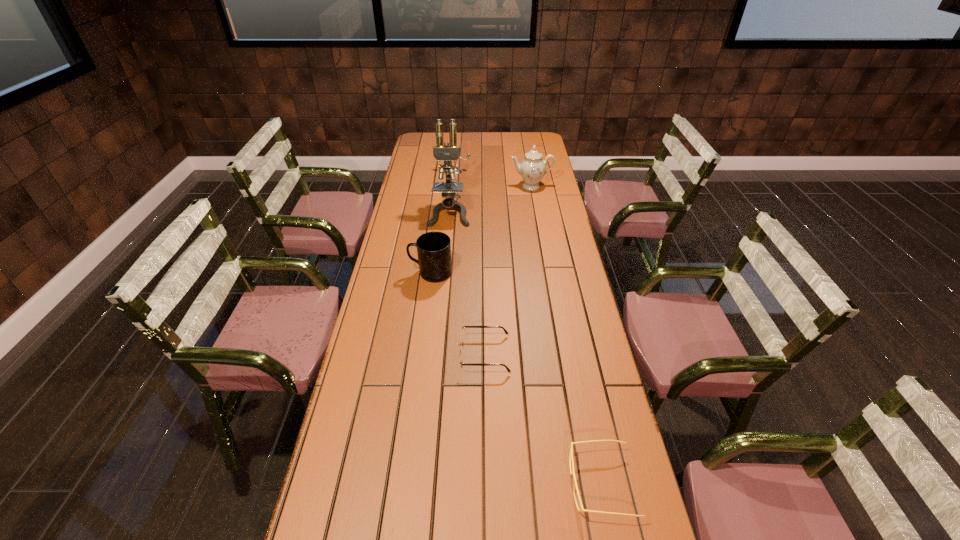
Find the location of a particular element. The image size is (960, 540). the fourth nearest object is located at coordinates (447, 153).

Locate an element on the screen. The width and height of the screenshot is (960, 540). the tallest object is located at coordinates (447, 153).

Identify the location of the second farthest object. (532, 168).

Locate an element on the screen. the second tallest object is located at coordinates [532, 168].

Image resolution: width=960 pixels, height=540 pixels. In order to click on candle in this screenshot , I will do `click(457, 171)`.

You are a GUI agent. You are given a task and a screenshot of the screen. Output one action in this format:
    pyautogui.click(x=<x>, y=<y>)
    Task: Click on the mug
    
    Given the screenshot: What is the action you would take?
    pyautogui.click(x=433, y=248)

Locate an element on the screen. This screenshot has width=960, height=540. the nearest object is located at coordinates (571, 448).

Image resolution: width=960 pixels, height=540 pixels. In order to click on the nearer spectacles in this screenshot , I will do `click(571, 448)`.

What are the coordinates of `the farther spectacles` in the screenshot? It's located at (461, 341).

This screenshot has width=960, height=540. I want to click on the second nearest object, so click(461, 341).